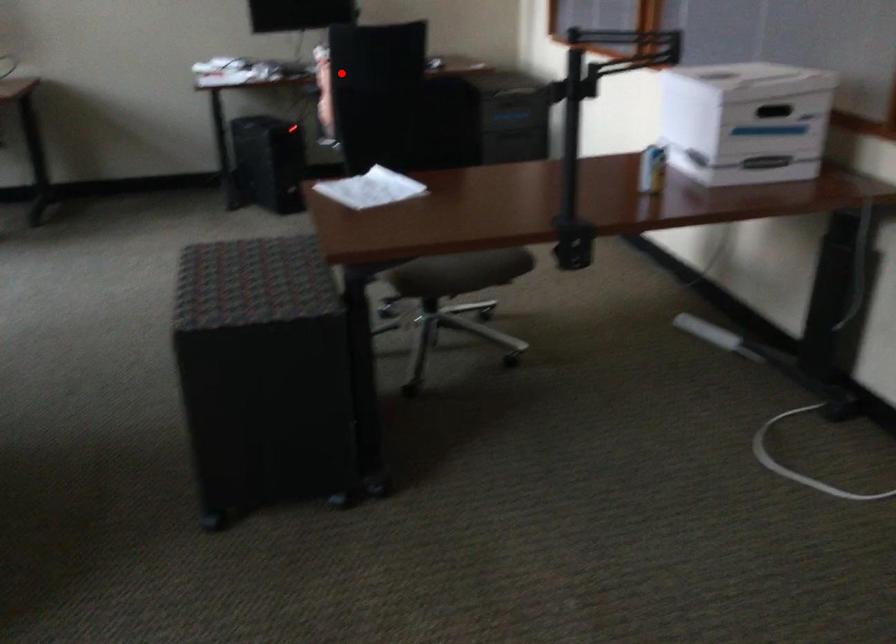
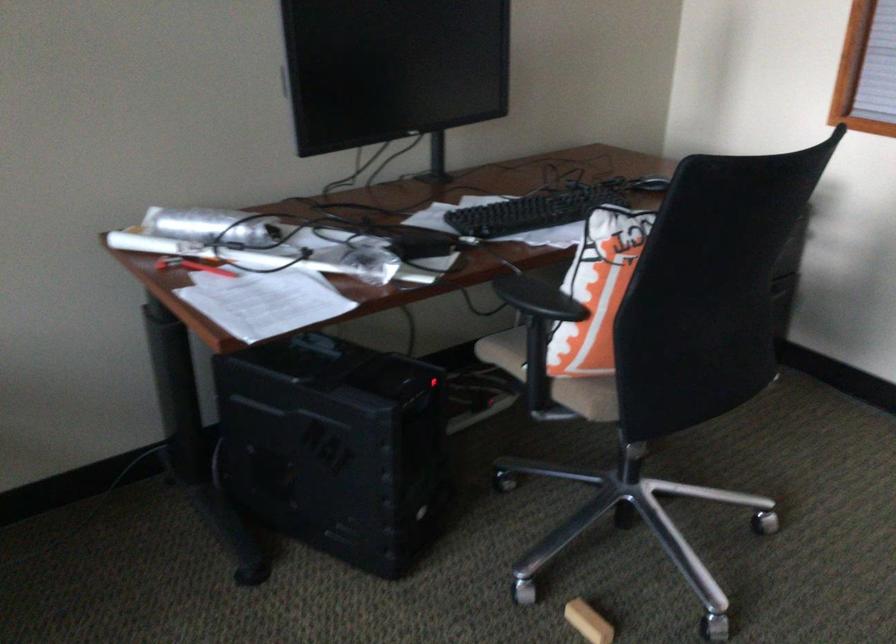
Question: A red point is marked in image1. In image2, is the corresponding 3D point closer to the camera or farther? Reply with the corresponding letter.

Choices:
 (A) The corresponding 3D point is closer.
 (B) The corresponding 3D point is farther.

Answer: (A)